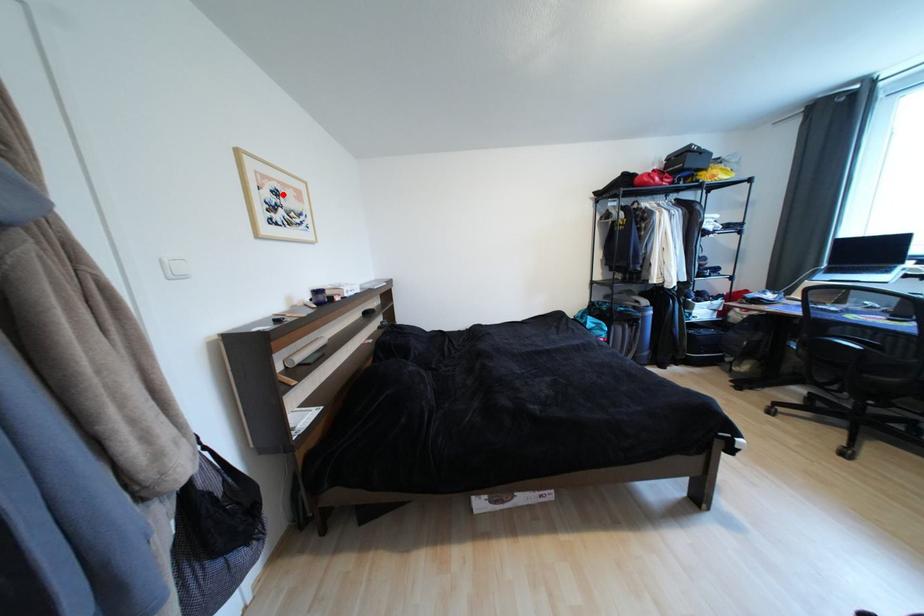
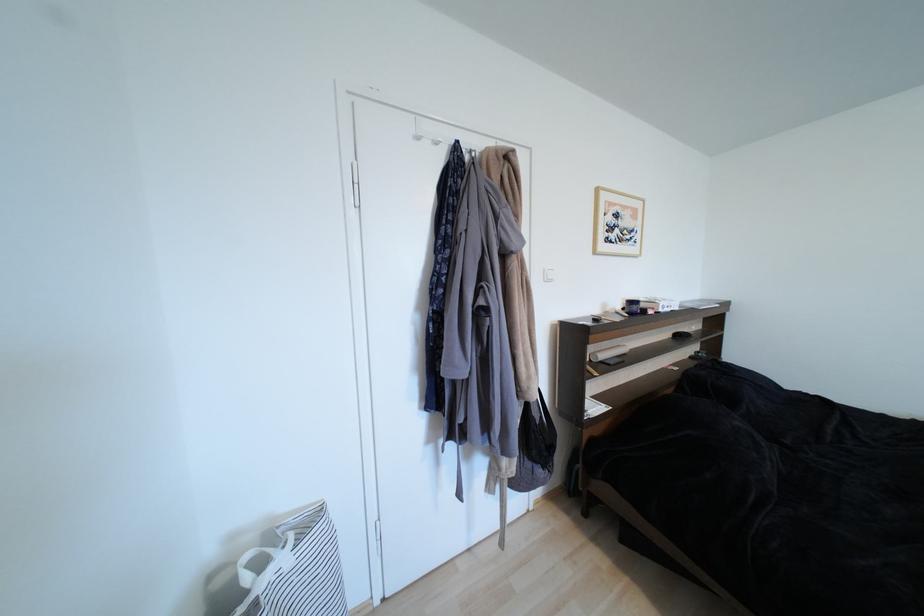
The point at the highlighted location is marked in the first image. Where is the corresponding point in the second image?

(623, 217)